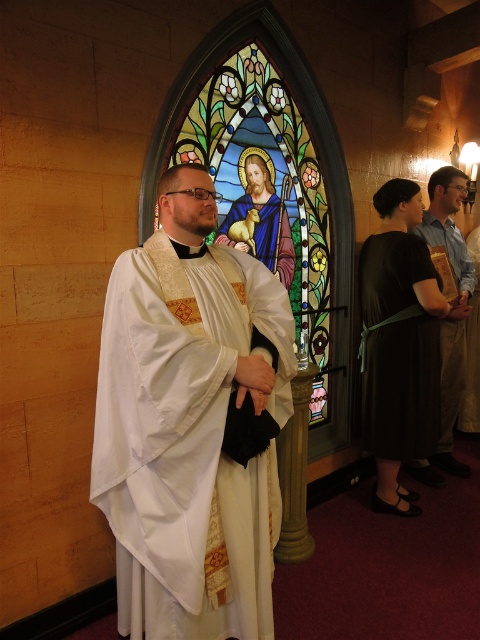
Is point (194, 381) closer to viewer compared to point (396, 378)?

Yes, point (194, 381) is in front of point (396, 378).

Which is behind, point (228, 570) or point (434, 400)?

Point (434, 400)

You are a GUI agent. You are given a task and a screenshot of the screen. Output one action in this format:
    pyautogui.click(x=<x>, y=<y>)
    Task: Click on the white satin robe at center
    The image size is (480, 640).
    Given the screenshot: What is the action you would take?
    pyautogui.click(x=192, y=424)

Does black satin dress at center appear on the left side of light blue shirt at center?

Indeed, black satin dress at center is positioned on the left side of light blue shirt at center.

Between point (398, 355) and point (440, 476), which one is positioned behind?

The point (440, 476) is behind.

Who is more forward, (374,348) or (445,365)?

Point (374,348) is in front.

Locate an element on the screen. black satin dress at center is located at coordinates (397, 349).

Is stained glass at center smaller than light blue shirt at center?

No.

Does point (200, 129) lie behind point (456, 305)?

No, it is in front of (456, 305).

Which is behind, point (311, 243) or point (454, 394)?

Point (454, 394)

Where is `stained glass at center`? The width and height of the screenshot is (480, 640). stained glass at center is located at coordinates (264, 180).